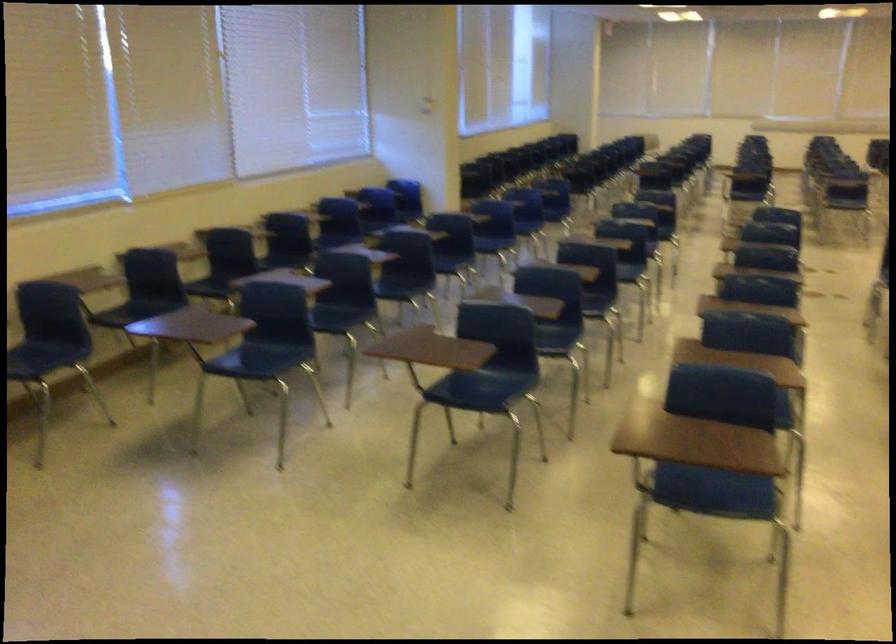
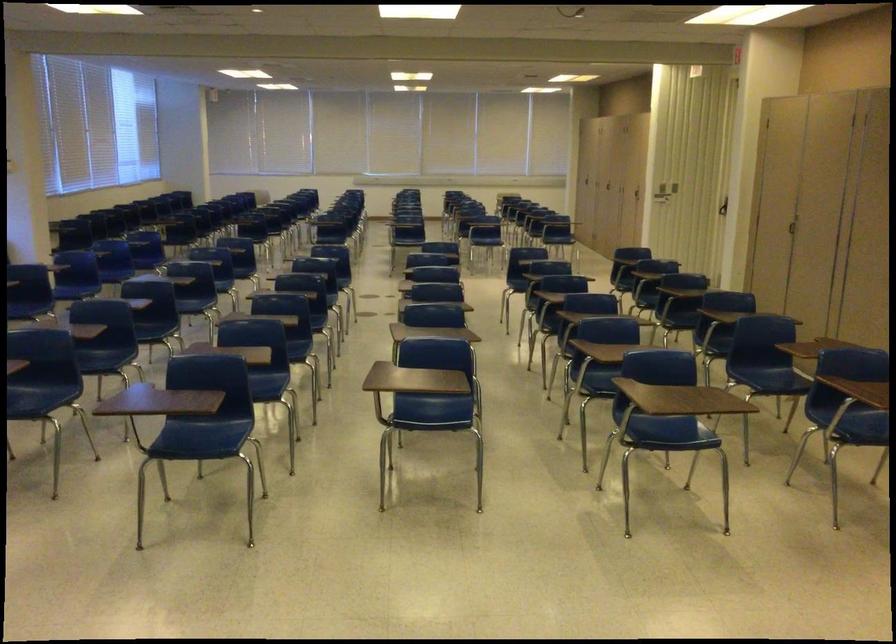
Where in the second image is the point corresponding to the point at 497,383 from the first image?

(39, 395)